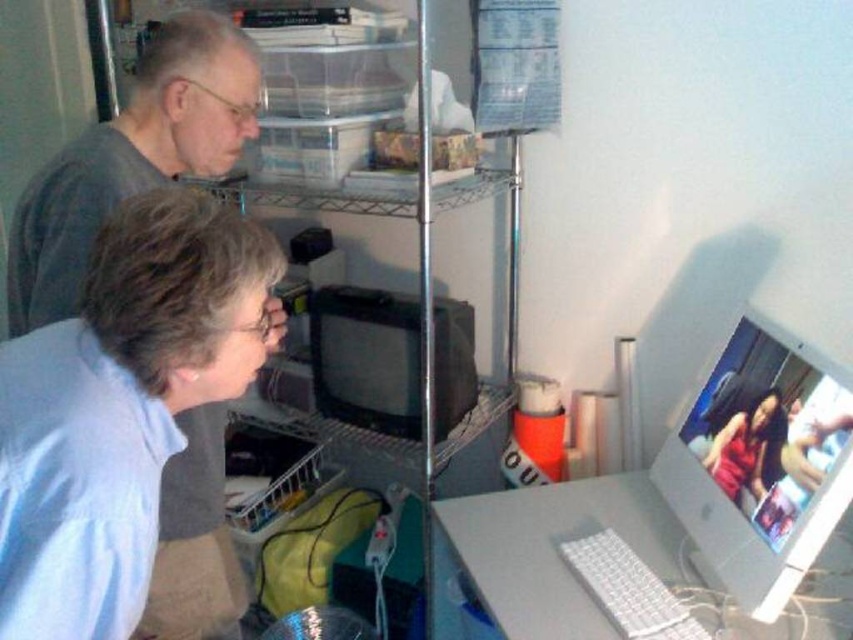
Question: Is matte gray shirt at left further to the viewer compared to matte red dress at center?

Choices:
 (A) yes
 (B) no

Answer: (B)

Question: Where is gray plastic computer desk at lower right located in relation to black plastic monitor at center in the image?

Choices:
 (A) right
 (B) left

Answer: (A)

Question: Which is nearer to the matte red dress at center?

Choices:
 (A) matte silver monitor at center right
 (B) black plastic monitor at center
 (C) gray plastic computer desk at lower right

Answer: (A)

Question: Which object appears closest to the camera in this image?

Choices:
 (A) matte gray shirt at left
 (B) matte silver monitor at center right
 (C) black plastic monitor at center
 (D) gray matte shirt at upper left

Answer: (B)

Question: Can you confirm if matte gray shirt at left is positioned to the left of matte silver monitor at center right?

Choices:
 (A) no
 (B) yes

Answer: (B)

Question: Estimate the real-world distances between objects in this image. Which object is closer to the matte silver monitor at center right?

Choices:
 (A) matte red dress at center
 (B) black plastic monitor at center
 (C) gray plastic computer desk at lower right
 (D) matte gray shirt at left

Answer: (A)